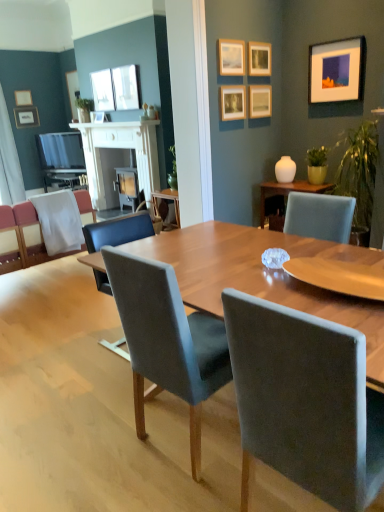
In order to face matte gray chair at center, which is the third chair in left-to-right order, should I rotate leftwards or rightwards?

Turn right by 17.235 degrees to look at matte gray chair at center, which is the third chair in left-to-right order.

Measure the distance between point (280, 165) and camera.

Point (280, 165) is 4.19 meters from camera.

Find the location of `wooden picture frame at upper center, the 7th picture frame from the front`. wooden picture frame at upper center, the 7th picture frame from the front is located at coordinates (97, 116).

Locate an element on the screen. This screenshot has height=512, width=384. white wood fireplace at upper center is located at coordinates (119, 148).

This screenshot has width=384, height=512. What do you see at coordinates (288, 191) in the screenshot? I see `translucent glass coffee table at center` at bounding box center [288, 191].

The image size is (384, 512). Identify the location of matte gray chair at center, arranged as the first chair when viewed from the right. (305, 401).

Is wooden picture frame at upper center, the 7th picture frame from the front, aimed at fabric upholstered chair at center, positioned as the 2th chair in left-to-right order?

No.

Which object is further away from the camera, wooden picture frame at upper center, the 7th picture frame from the front, or fabric upholstered chair at center, acting as the 2th chair starting from the front?

wooden picture frame at upper center, the 7th picture frame from the front, is further from the camera.

From the image's perspective, does wooden picture frame at upper center, the 7th picture frame from the front, appear higher than fabric upholstered chair at center, acting as the 2th chair starting from the front?

Yes, from the image's perspective, wooden picture frame at upper center, the 7th picture frame from the front, is over fabric upholstered chair at center, acting as the 2th chair starting from the front.

Would you say clear glass window screen at upper center is to the left or to the right of green glossy vase at upper right in the picture?

Based on their positions, clear glass window screen at upper center is located to the left of green glossy vase at upper right.

Is clear glass window screen at upper center turned away from green glossy vase at upper right?

No, green glossy vase at upper right is not at the back of clear glass window screen at upper center.

Considering the positions of objects clear glass window screen at upper center and green glossy vase at upper right in the image provided, who is behind, clear glass window screen at upper center or green glossy vase at upper right?

clear glass window screen at upper center is behind.

This screenshot has width=384, height=512. I want to click on window screen on the left of green glossy vase at upper right, so point(103,90).

Is point (83, 163) closer to camera compared to point (325, 157)?

No, (83, 163) is behind (325, 157).

Is green matte plant at right, the second houseplant viewed from the left, surrounded by matte black tv at left?

Actually, green matte plant at right, the second houseplant viewed from the left, is outside matte black tv at left.

Is matte black tv at left oriented away from green matte plant at right, the 1th houseplant in the front-to-back sequence?

That's not correct — matte black tv at left is not looking away from green matte plant at right, the 1th houseplant in the front-to-back sequence.

This screenshot has width=384, height=512. In order to click on houseplant that is the 2nd object located in front of the matte black tv at left in this screenshot , I will do `click(317, 165)`.

Considering the points (101, 120) and (280, 178), which point is in front, point (101, 120) or point (280, 178)?

The point (280, 178) is closer to the camera.

Consider the image. Which object is further away from the camera, wooden picture frame at upper center, the seventh picture frame when ordered from right to left, or white glossy vase at upper right?

wooden picture frame at upper center, the seventh picture frame when ordered from right to left, is further away from the camera.

Based on the photo, from a real-world perspective, is wooden picture frame at upper center, the seventh picture frame when ordered from right to left, positioned over white glossy vase at upper right based on gravity?

Yes, from a real-world perspective, wooden picture frame at upper center, the seventh picture frame when ordered from right to left, is over white glossy vase at upper right

Which of these two, wooden picture frame at upper center, the 7th picture frame from the front, or white glossy vase at upper right, is smaller?

wooden picture frame at upper center, the 7th picture frame from the front.

In terms of width, does matte wooden picture frame at upper center, the 4th picture frame in the front-to-back sequence, look wider or thinner when compared to white glossy vase at upper right?

In the image, matte wooden picture frame at upper center, the 4th picture frame in the front-to-back sequence, appears to be more narrow than white glossy vase at upper right.

Is white glossy vase at upper right completely or partially inside matte wooden picture frame at upper center, positioned as the 3th picture frame in right-to-left order?

No, white glossy vase at upper right is not surrounded by matte wooden picture frame at upper center, positioned as the 3th picture frame in right-to-left order.

Is the position of matte wooden picture frame at upper center, positioned as the 3th picture frame in right-to-left order, less distant than that of white glossy vase at upper right?

Yes.

Looking at their sizes, would you say green leafy plant at upper left, which is the 1th houseplant from left to right, is wider or thinner than white fabric chair at left, which is the 1th chair in back-to-front order?

Clearly, green leafy plant at upper left, which is the 1th houseplant from left to right, has less width compared to white fabric chair at left, which is the 1th chair in back-to-front order.

Could white fabric chair at left, which is the 1th chair in left-to-right order, be considered to be inside green leafy plant at upper left, positioned as the second houseplant in front-to-back order?

No, white fabric chair at left, which is the 1th chair in left-to-right order, is not a part of green leafy plant at upper left, positioned as the second houseplant in front-to-back order.

Which is behind, green leafy plant at upper left, positioned as the 2th houseplant in right-to-left order, or white fabric chair at left, which appears as the third chair when viewed from the front?

green leafy plant at upper left, positioned as the 2th houseplant in right-to-left order.

In terms of size, does matte white picture frame at upper right, arranged as the first picture frame when viewed from the front, appear bigger or smaller than green matte plant at right, the first houseplant ordered from the bottom?

Clearly, matte white picture frame at upper right, arranged as the first picture frame when viewed from the front, is smaller in size than green matte plant at right, the first houseplant ordered from the bottom.

From the image's perspective, would you say matte white picture frame at upper right, arranged as the first picture frame when viewed from the front, is positioned over green matte plant at right, the 1th houseplant in the front-to-back sequence?

Indeed, from the image's perspective, matte white picture frame at upper right, arranged as the first picture frame when viewed from the front, is shown above green matte plant at right, the 1th houseplant in the front-to-back sequence.

Is matte white picture frame at upper right, which ranks as the tenth picture frame in left-to-right order, further to camera compared to green matte plant at right, the first houseplant positioned from the right?

No, it is in front of green matte plant at right, the first houseplant positioned from the right.

Where is `the 3rd chair directly beneath the wooden picture frame at upper center, which ranks as the fourth picture frame in left-to-right order (from a real-world perspective)`? This screenshot has width=384, height=512. the 3rd chair directly beneath the wooden picture frame at upper center, which ranks as the fourth picture frame in left-to-right order (from a real-world perspective) is located at coordinates (167, 341).

At what (x,y) coordinates should I click in order to perform the action: click on plant that appears below the clear glass window screen at upper center (from the image's perspective). Please return your answer as a coordinate pair (x, y). The image size is (384, 512). Looking at the image, I should click on (359, 169).

Based on their spatial positions, is fabric upholstered chair at center, arranged as the 2th chair when viewed from the right, or white glossy vase at upper right closer to matte white picture frame at upper center, which is counted as the 5th picture frame, starting from the right?

Based on the image, white glossy vase at upper right appears to be nearer to matte white picture frame at upper center, which is counted as the 5th picture frame, starting from the right.

Considering their positions, is white fabric chair at left, the 3th chair in the right-to-left sequence, positioned closer to white wood fireplace at upper center than clear glass window screen at upper center?

clear glass window screen at upper center lies closer to white wood fireplace at upper center than the other object.

When comparing their distances from matte black tv at left, does matte gray table at center or matte white picture frame at upper center, which is counted as the 5th picture frame, starting from the right, seem closer?

Among the two, matte white picture frame at upper center, which is counted as the 5th picture frame, starting from the right, is located nearer to matte black tv at left.

From the image, which object appears to be nearer to translucent glass coffee table at center, matte wooden picture frame at upper center, the fifth picture frame viewed from the front, or matte glass picture frame at upper center, marked as the fifth picture frame in a back-to-front arrangement?

Based on the image, matte wooden picture frame at upper center, the fifth picture frame viewed from the front, appears to be nearer to translucent glass coffee table at center.

Based on the photo, looking at the image, which one is located closer to fabric upholstered chair at center, positioned as the 2th chair in left-to-right order, matte wooden picture frame at upper center, positioned as the 3th picture frame in right-to-left order, or matte silver picture frame at upper left, which is the 10th picture frame in front-to-back order?

matte wooden picture frame at upper center, positioned as the 3th picture frame in right-to-left order, is positioned closer to the anchor fabric upholstered chair at center, positioned as the 2th chair in left-to-right order.

From the image, which object appears to be farther from matte wooden picture frame at upper center, positioned as the second picture frame in right-to-left order, white fabric curtain at left or matte black tv at left?

white fabric curtain at left is positioned further to the anchor matte wooden picture frame at upper center, positioned as the second picture frame in right-to-left order.

When comparing their distances from matte silver picture frame at upper left, the 2th picture frame in the left-to-right sequence, does matte wooden picture frame at upper center, which appears as the seventh picture frame when viewed from the back, or matte gray table at center seem closer?

Among the two, matte wooden picture frame at upper center, which appears as the seventh picture frame when viewed from the back, is located nearer to matte silver picture frame at upper left, the 2th picture frame in the left-to-right sequence.

Estimate the real-world distances between objects in this image. Which object is further from matte wooden picture frame at upper center, positioned as the 3th picture frame in right-to-left order, matte white picture frame at upper left, the eighth picture frame from the right, or white wood fireplace at upper center?

matte white picture frame at upper left, the eighth picture frame from the right.

Identify the location of fireplace between matte gray table at center and matte silver picture frame at upper left, placed as the ninth picture frame when sorted from right to left, in the front-back direction. pyautogui.click(x=119, y=148).

Image resolution: width=384 pixels, height=512 pixels. In order to click on fireplace between wooden picture frame at upper center, which ranks as the fourth picture frame in left-to-right order, and matte wooden picture frame at upper center, placed as the 9th picture frame when sorted from left to right, in the horizontal direction in this screenshot , I will do `click(119, 148)`.

The height and width of the screenshot is (512, 384). In order to click on television between white fabric curtain at left and translucent glass coffee table at center from left to right in this screenshot , I will do 60,151.

Identify the location of houseplant between matte gray chair at center, which is counted as the first chair, starting from the front, and clear glass window screen at upper center, along the z-axis. (317, 165).